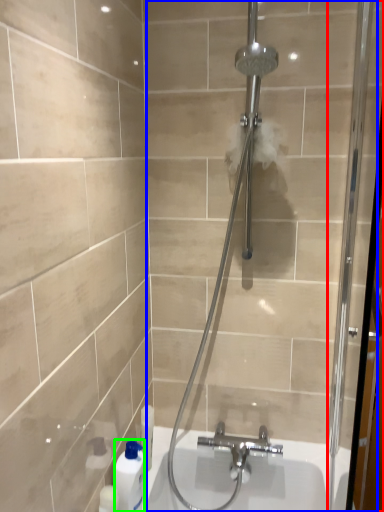
Question: Which object is the closest to the screen door (highlighted by a red box)? Choose among these: shower door (highlighted by a blue box) or cleaning product (highlighted by a green box).

Choices:
 (A) shower door
 (B) cleaning product

Answer: (A)